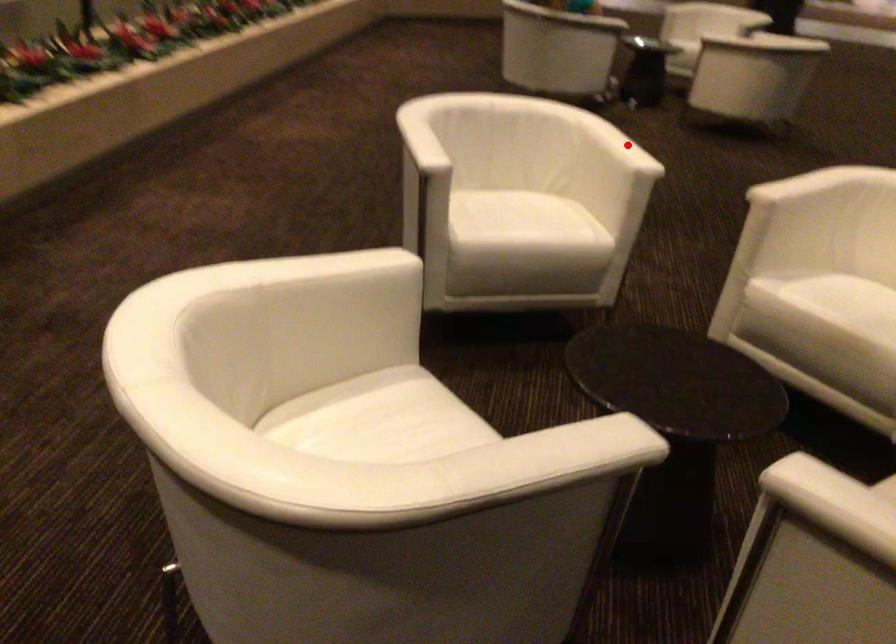
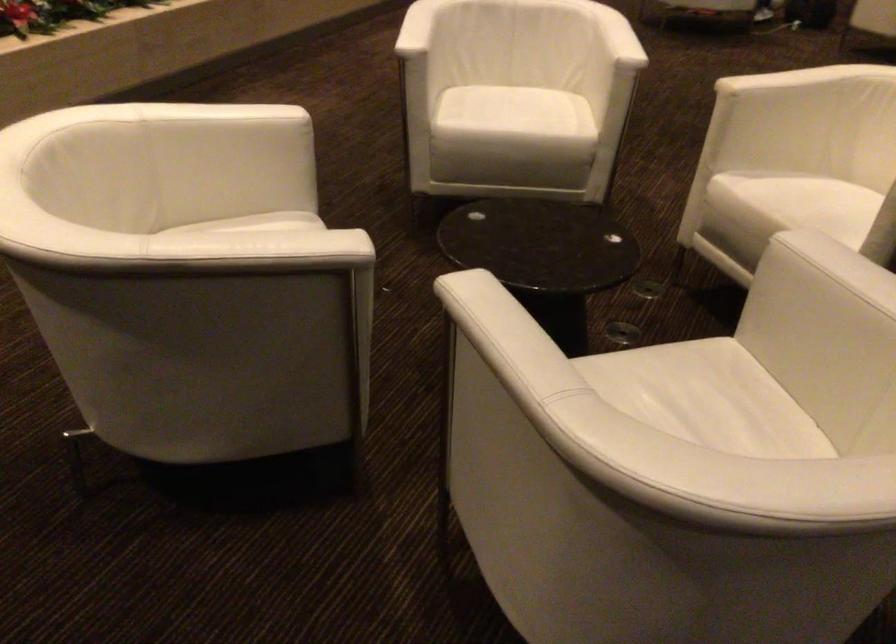
Locate, in the second image, the point that corresponds to the highlighted location in the first image.

(617, 37)